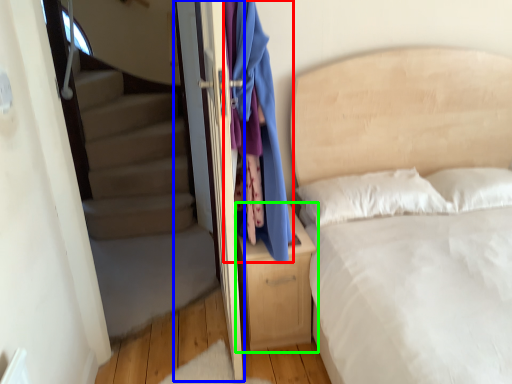
Question: Considering the real-world distances, which object is farthest from clothing (highlighted by a red box)? screen door (highlighted by a blue box) or nightstand (highlighted by a green box)?

Choices:
 (A) screen door
 (B) nightstand

Answer: (A)